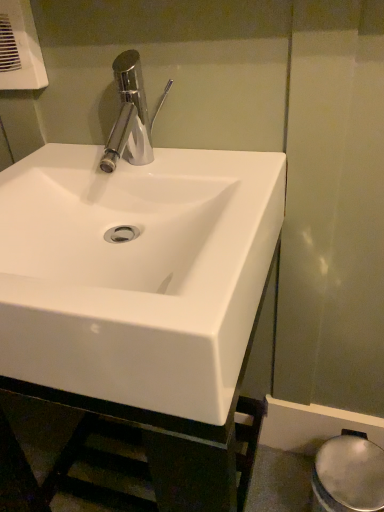
Describe the element at coordinates (136, 270) in the screenshot. I see `white glossy sink at center` at that location.

Locate an element on the screen. The height and width of the screenshot is (512, 384). white glossy bidet at lower right is located at coordinates (348, 476).

Locate an element on the screen. The width and height of the screenshot is (384, 512). white glossy sink at center is located at coordinates (136, 270).

What's the angular difference between white glossy bidet at lower right and white glossy sink at center's facing directions?

There is a 0.492-degree angle between the facing directions of white glossy bidet at lower right and white glossy sink at center.

Considering the sizes of objects white glossy bidet at lower right and white glossy sink at center in the image provided, who is wider, white glossy bidet at lower right or white glossy sink at center?

white glossy sink at center is wider.

Identify the location of bidet to the right of white glossy sink at center. The width and height of the screenshot is (384, 512). (348, 476).

From the image's perspective, who appears lower, white glossy bidet at lower right or white glossy sink at center?

white glossy bidet at lower right.

Can you confirm if white glossy sink at center is taller than white glossy bidet at lower right?

Yes, white glossy sink at center is taller than white glossy bidet at lower right.

How distant is white glossy sink at center from white glossy bidet at lower right?

They are 23.30 inches apart.

From a real-world perspective, relative to white glossy bidet at lower right, is white glossy sink at center vertically above or below?

In terms of real-world spatial position, white glossy sink at center is above white glossy bidet at lower right.

From the image's perspective, who appears lower, white glossy sink at center or white glossy bidet at lower right?

white glossy bidet at lower right.

Is white plastic hand dryer at upper left positioned with its back to white glossy bidet at lower right?

No, white plastic hand dryer at upper left is not facing the opposite direction of white glossy bidet at lower right.

Considering the positions of points (21, 48) and (363, 454), is point (21, 48) closer to camera compared to point (363, 454)?

Yes.

Does white plastic hand dryer at upper left have a lesser width compared to white glossy bidet at lower right?

Correct, the width of white plastic hand dryer at upper left is less than that of white glossy bidet at lower right.

From a real-world perspective, is white plastic hand dryer at upper left located higher than white glossy bidet at lower right?

Correct, in the physical world, white plastic hand dryer at upper left is higher than white glossy bidet at lower right.

How many degrees apart are the facing directions of white glossy bidet at lower right and white plastic hand dryer at upper left?

white glossy bidet at lower right and white plastic hand dryer at upper left are facing 0.49 degrees away from each other.

Could white plastic hand dryer at upper left be considered to be inside white glossy bidet at lower right?

No, white plastic hand dryer at upper left is not a part of white glossy bidet at lower right.

At what (x,y) coordinates should I click in order to perform the action: click on hand dryer in front of the white glossy bidet at lower right. Please return your answer as a coordinate pair (x, y). Looking at the image, I should click on (20, 48).

Considering the sizes of white plastic hand dryer at upper left and white glossy sink at center in the image, is white plastic hand dryer at upper left wider or thinner than white glossy sink at center?

Clearly, white plastic hand dryer at upper left has less width compared to white glossy sink at center.

Considering the points (34, 48) and (202, 221), which point is in front, point (34, 48) or point (202, 221)?

Point (202, 221)

Who is bigger, white plastic hand dryer at upper left or white glossy sink at center?

Bigger between the two is white glossy sink at center.

Could you tell me if white plastic hand dryer at upper left is facing white glossy sink at center?

No.

Can you confirm if white glossy sink at center is bigger than white plastic hand dryer at upper left?

Yes.

Is white glossy sink at center not near white plastic hand dryer at upper left?

No, white glossy sink at center is not far away from white plastic hand dryer at upper left.

What are the coordinates of `sink beneath the white plastic hand dryer at upper left (from a real-world perspective)` in the screenshot? It's located at (136, 270).

Between white glossy sink at center and white plastic hand dryer at upper left, which one has more height?

Standing taller between the two is white glossy sink at center.

This screenshot has width=384, height=512. In the image, there is a white glossy sink at center. In order to click on bidet below it (from the image's perspective) in this screenshot , I will do `click(348, 476)`.

Where is `sink that appears above the white glossy bidet at lower right (from a real-world perspective)`? The image size is (384, 512). sink that appears above the white glossy bidet at lower right (from a real-world perspective) is located at coordinates (136, 270).

Based on their spatial positions, is white plastic hand dryer at upper left or white glossy sink at center further from white glossy bidet at lower right?

Among the two, white plastic hand dryer at upper left is located further to white glossy bidet at lower right.

From the image, which object appears to be farther from white glossy sink at center, white plastic hand dryer at upper left or white glossy bidet at lower right?

white glossy bidet at lower right lies further to white glossy sink at center than the other object.

Based on their spatial positions, is white glossy sink at center or white plastic hand dryer at upper left closer to white glossy bidet at lower right?

white glossy sink at center lies closer to white glossy bidet at lower right than the other object.

From the image, which object appears to be farther from white glossy sink at center, white glossy bidet at lower right or white plastic hand dryer at upper left?

The object further to white glossy sink at center is white glossy bidet at lower right.

Considering their positions, is white glossy sink at center positioned closer to white plastic hand dryer at upper left than white glossy bidet at lower right?

white glossy sink at center.

Looking at the image, which one is located further to white plastic hand dryer at upper left, white glossy bidet at lower right or white glossy sink at center?

white glossy bidet at lower right is further to white plastic hand dryer at upper left.

Image resolution: width=384 pixels, height=512 pixels. In order to click on sink between white plastic hand dryer at upper left and white glossy bidet at lower right vertically in this screenshot , I will do `click(136, 270)`.